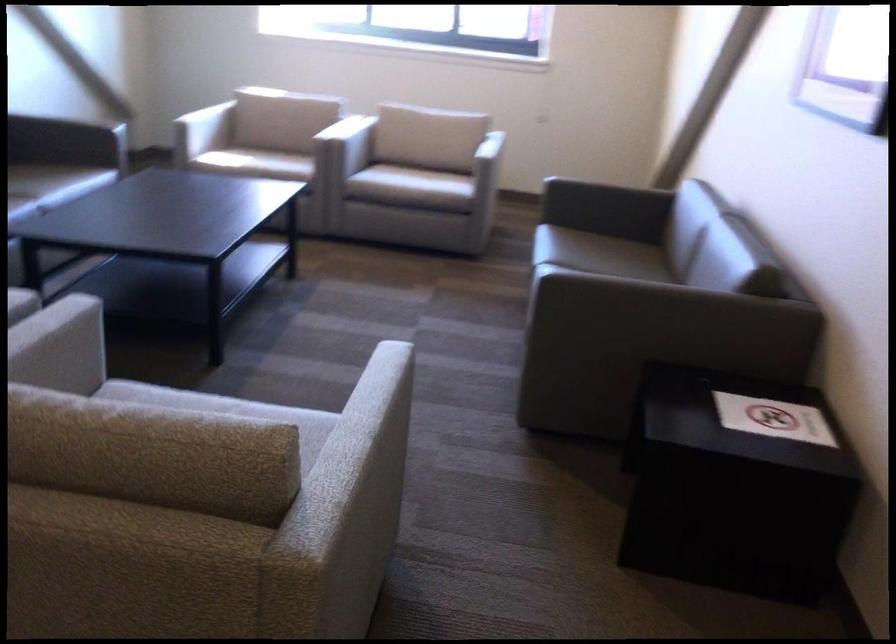
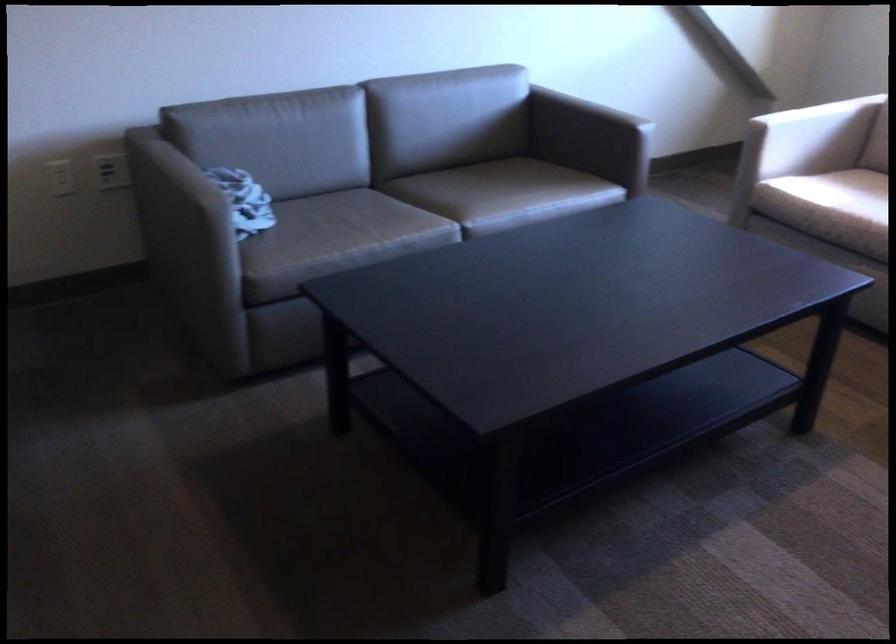
Find the pixel in the second image that matches point 209,118 in the first image.

(824, 137)